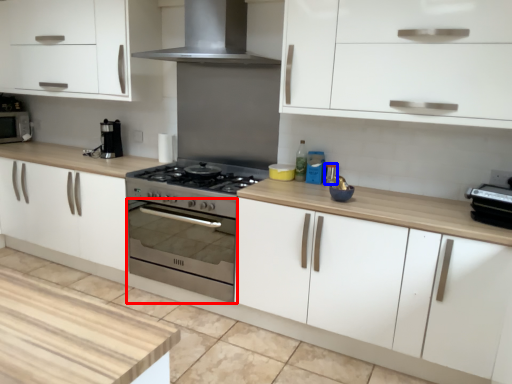
Question: Which object appears closest to the camera in this image, oven (highlighted by a red box) or appliance (highlighted by a blue box)?

Choices:
 (A) oven
 (B) appliance

Answer: (A)